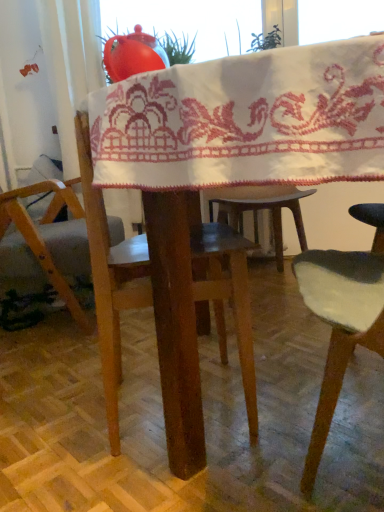
Question: In the image, is wooden table at center on the left side or the right side of white embroidered cloth at center?

Choices:
 (A) right
 (B) left

Answer: (A)

Question: Is point (132, 135) closer or farther from the camera than point (264, 110)?

Choices:
 (A) closer
 (B) farther

Answer: (B)

Question: Considering the real-world distances, which object is closest to the white embroidered cloth at center?

Choices:
 (A) wooden chair at left
 (B) wooden table at center

Answer: (B)

Question: Estimate the real-world distances between objects in this image. Which object is closer to the wooden chair at left?

Choices:
 (A) white embroidered cloth at center
 (B) wooden table at center

Answer: (B)